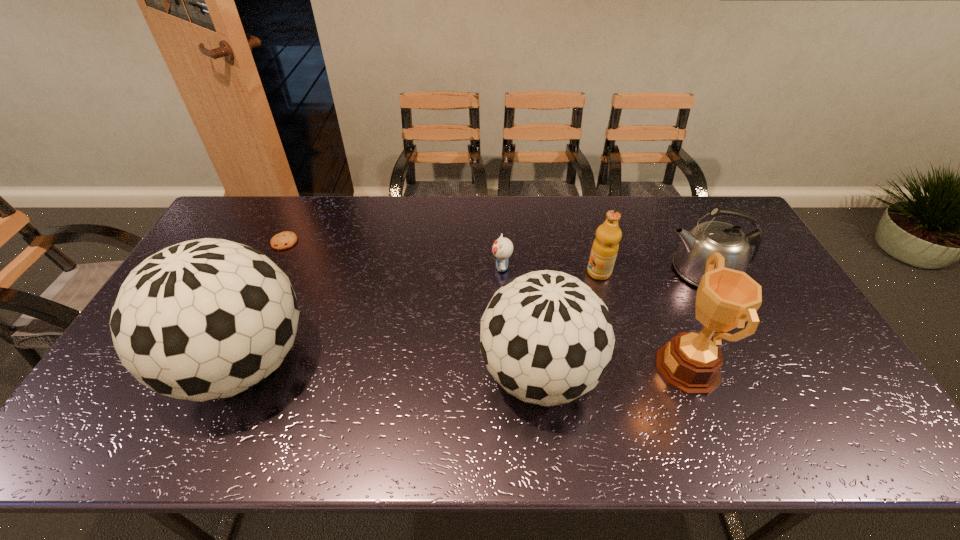
Locate an element on the screen. The image size is (960, 540). free region located 0.280m on the spout of the kettle is located at coordinates (573, 269).

Locate an element on the screen. This screenshot has width=960, height=540. vacant space located on the spout of the kettle is located at coordinates (576, 269).

Locate an element on the screen. The width and height of the screenshot is (960, 540). free region located 0.250m on the spout of the kettle is located at coordinates (583, 269).

Identify the location of vacant space located on the front-facing side of the kitten. This screenshot has width=960, height=540. (460, 267).

You are a GUI agent. You are given a task and a screenshot of the screen. Output one action in this format:
    pyautogui.click(x=<x>, y=<y>)
    Task: Click on the vacant space situated 0.380m on the front-facing side of the kitten
    This screenshot has width=960, height=540.
    Given the screenshot: What is the action you would take?
    pyautogui.click(x=372, y=267)

Image resolution: width=960 pixels, height=540 pixels. I want to click on vacant space located 0.140m on the front-facing side of the kitten, so click(447, 267).

Find the location of `vacant area located 0.400m on the front label of the third object from right to left`. vacant area located 0.400m on the front label of the third object from right to left is located at coordinates (461, 273).

You are a GUI agent. You are given a task and a screenshot of the screen. Output one action in this format:
    pyautogui.click(x=<x>, y=<y>)
    Task: Click on the vacant space positioned on the front label of the third object from right to left
    
    Given the screenshot: What is the action you would take?
    pyautogui.click(x=567, y=273)

What are the coordinates of `vacant space situated 0.250m on the front label of the third object from right to left` in the screenshot? It's located at (508, 273).

Find the location of a particular element. The width and height of the screenshot is (960, 540). free space located 0.340m on the front-facing side of the award is located at coordinates (525, 368).